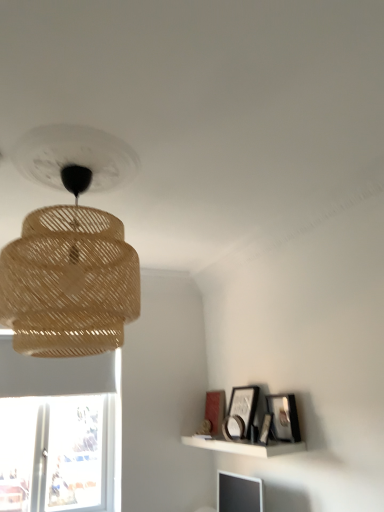
Question: Is matte black picture frame at upper right, marked as the 1th picture frame in a back-to-front arrangement, wider than matte black picture frame at upper right, positioned as the 4th picture frame in front-to-back order?

Choices:
 (A) no
 (B) yes

Answer: (A)

Question: Is matte black picture frame at upper right, marked as the 1th picture frame in a back-to-front arrangement, oriented towards matte black picture frame at upper right, positioned as the 4th picture frame in front-to-back order?

Choices:
 (A) no
 (B) yes

Answer: (A)

Question: From the image's perspective, is matte black picture frame at upper right, marked as the 1th picture frame in a back-to-front arrangement, located beneath matte black picture frame at upper right, positioned as the 4th picture frame in front-to-back order?

Choices:
 (A) no
 (B) yes

Answer: (B)

Question: Can you confirm if matte black picture frame at upper right, acting as the fifth picture frame starting from the front, is positioned to the right of matte black picture frame at upper right, the 2th picture frame from the back?

Choices:
 (A) no
 (B) yes

Answer: (A)

Question: From a real-world perspective, is matte black picture frame at upper right, acting as the fifth picture frame starting from the front, positioned under matte black picture frame at upper right, positioned as the 4th picture frame in front-to-back order, based on gravity?

Choices:
 (A) yes
 (B) no

Answer: (A)

Question: From the image's perspective, is matte black picture frame at upper right, which is the second picture frame in front-to-back order, positioned above or below matte black picture frame at lower right, arranged as the fifth picture frame when viewed from the back?

Choices:
 (A) above
 (B) below

Answer: (A)

Question: From their relative heights in the image, would you say matte black picture frame at upper right, the fourth picture frame from the back, is taller or shorter than matte black picture frame at lower right, arranged as the fifth picture frame when viewed from the back?

Choices:
 (A) short
 (B) tall

Answer: (B)

Question: In the image, is matte black picture frame at upper right, the fourth picture frame from the back, positioned in front of or behind matte black picture frame at lower right, arranged as the 1th picture frame when viewed from the front?

Choices:
 (A) behind
 (B) front

Answer: (A)

Question: Looking at their shapes, would you say matte black picture frame at upper right, the fourth picture frame from the back, is wider or thinner than matte black picture frame at lower right, arranged as the 1th picture frame when viewed from the front?

Choices:
 (A) wide
 (B) thin

Answer: (A)

Question: In terms of width, does matte black picture frame at upper right, the 2th picture frame from the back, look wider or thinner when compared to wooden picture frame at upper right, marked as the third picture frame in a back-to-front arrangement?

Choices:
 (A) thin
 (B) wide

Answer: (B)

Question: From a real-world perspective, is matte black picture frame at upper right, positioned as the 4th picture frame in front-to-back order, above or below wooden picture frame at upper right, placed as the 3th picture frame when sorted from front to back?

Choices:
 (A) above
 (B) below

Answer: (A)

Question: From the image's perspective, is matte black picture frame at upper right, positioned as the 4th picture frame in front-to-back order, located above or below wooden picture frame at upper right, marked as the third picture frame in a back-to-front arrangement?

Choices:
 (A) above
 (B) below

Answer: (A)

Question: Based on their sizes in the image, would you say matte black picture frame at upper right, the 2th picture frame from the back, is bigger or smaller than wooden picture frame at upper right, placed as the 3th picture frame when sorted from front to back?

Choices:
 (A) big
 (B) small

Answer: (A)

Question: Relative to natural woven lampshade at upper left, is white matte shelf at lower right in front or behind?

Choices:
 (A) front
 (B) behind

Answer: (B)

Question: Considering the positions of white matte shelf at lower right and natural woven lampshade at upper left in the image, is white matte shelf at lower right bigger or smaller than natural woven lampshade at upper left?

Choices:
 (A) big
 (B) small

Answer: (B)